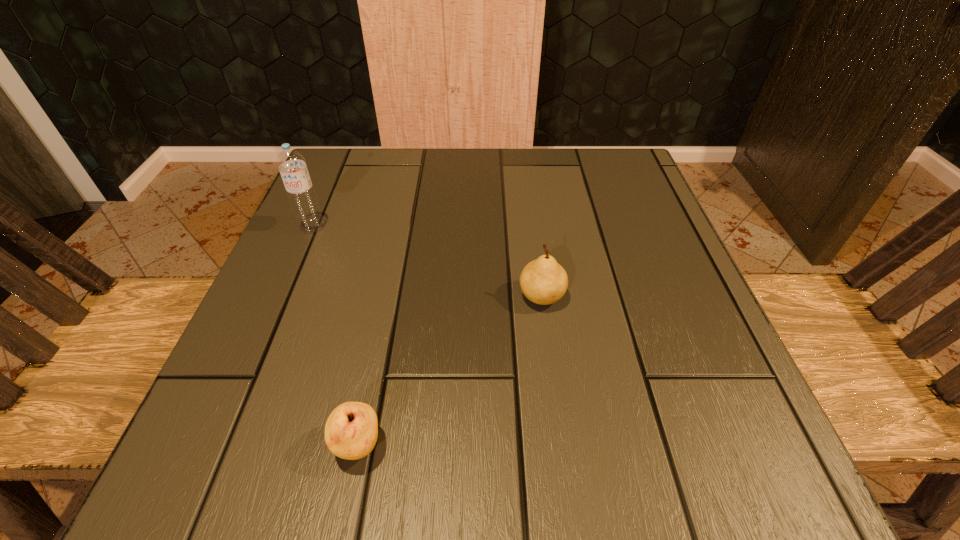
The width and height of the screenshot is (960, 540). Identify the location of vacant area that lies between the tallest object and the nearest object. (335, 336).

The width and height of the screenshot is (960, 540). Identify the location of free space between the shortest object and the farthest object. (335, 336).

This screenshot has height=540, width=960. Identify the location of vacant region between the farthest object and the right pear. (427, 261).

The height and width of the screenshot is (540, 960). Identify the location of vacant area that lies between the right pear and the second object from left to right. (450, 371).

This screenshot has height=540, width=960. I want to click on vacant space that's between the second shortest object and the water bottle, so point(427,261).

This screenshot has width=960, height=540. Find the location of `vacant area that lies between the farthest object and the nearer pear`. vacant area that lies between the farthest object and the nearer pear is located at coordinates (335, 336).

Identify the location of empty location between the water bottle and the shorter pear. (335, 336).

I want to click on free space between the farther pear and the farthest object, so click(427, 261).

Image resolution: width=960 pixels, height=540 pixels. What are the coordinates of `vacant area between the tallest object and the nearest object` in the screenshot? It's located at [335, 336].

Where is `the closest object to the shorter pear`? This screenshot has width=960, height=540. the closest object to the shorter pear is located at coordinates (543, 281).